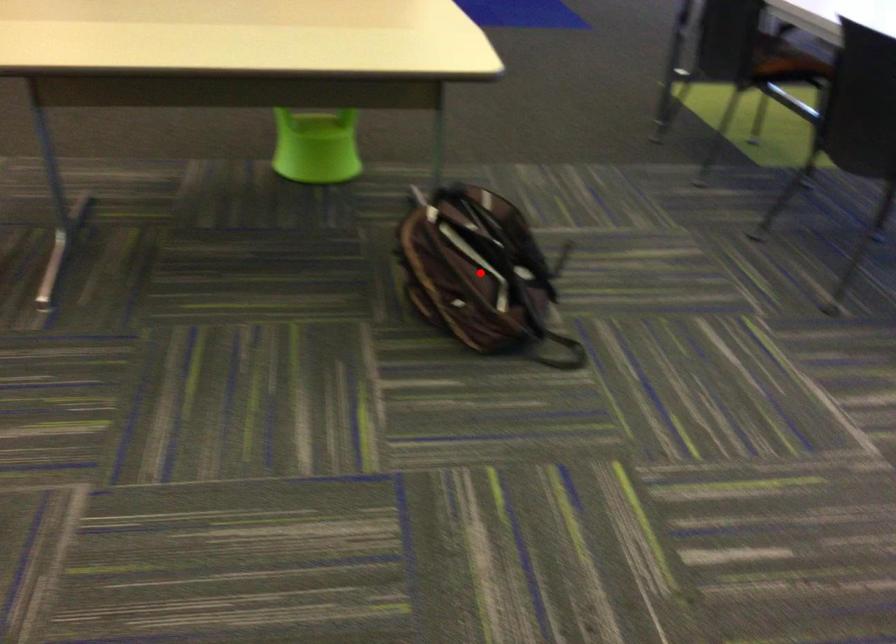
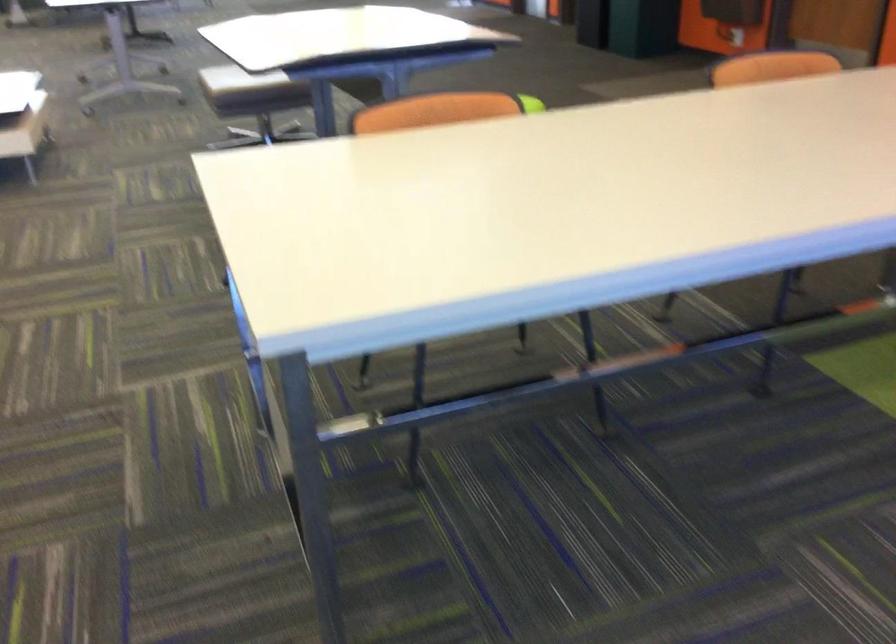
Question: I am providing you with two images of the same scene from different viewpoints. A red point is marked on the first image. Is the red point's position out of view in image 2?

Choices:
 (A) Yes
 (B) No

Answer: (A)